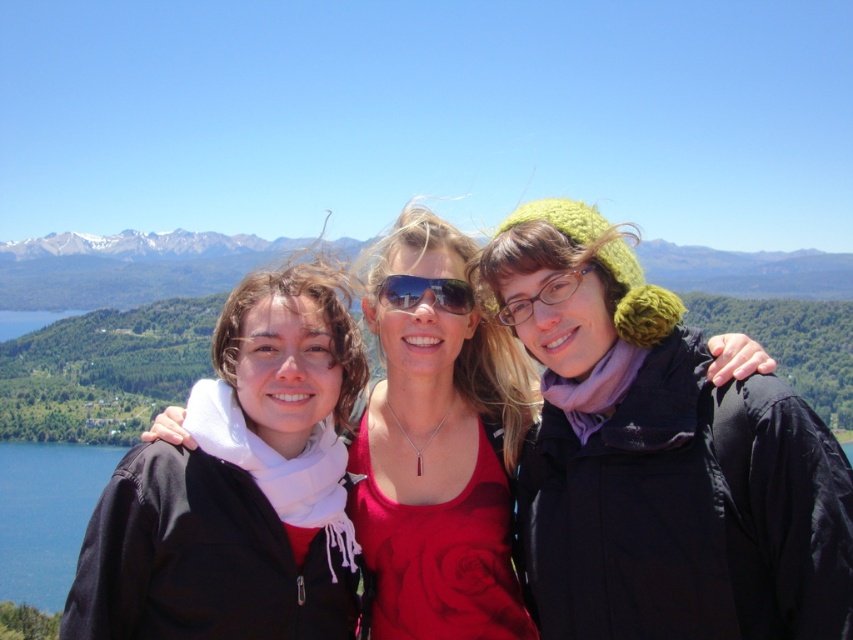
Is matte black jacket at center further to the viewer compared to shiny blue sunglasses at center?

No, it is not.

What do you see at coordinates (434, 436) in the screenshot?
I see `matte black jacket at center` at bounding box center [434, 436].

I want to click on matte black jacket at center, so click(434, 436).

Consider the image. Does knitted green hat at center have a lesser height compared to shiny blue sunglasses at center?

No.

Is point (671, 499) farther from camera compared to point (405, 276)?

No, it is in front of (405, 276).

Find the location of a particular element. The height and width of the screenshot is (640, 853). knitted green hat at center is located at coordinates (659, 458).

Is knitted green hat at center shorter than matte black jacket at center?

Indeed, knitted green hat at center has a lesser height compared to matte black jacket at center.

You are a GUI agent. You are given a task and a screenshot of the screen. Output one action in this format:
    pyautogui.click(x=<x>, y=<y>)
    Task: Click on the knitted green hat at center
    
    Given the screenshot: What is the action you would take?
    pyautogui.click(x=659, y=458)